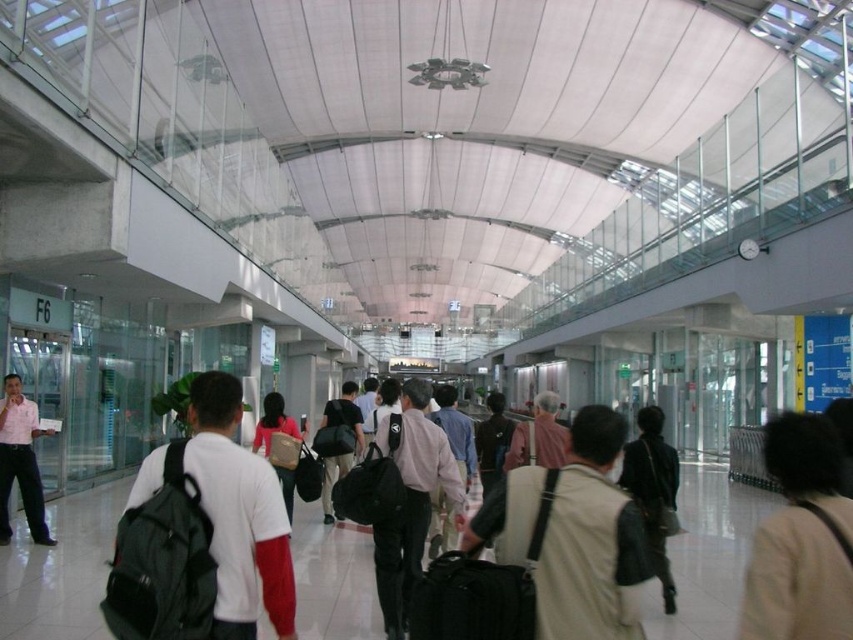
Does matte black backpack at center appear over black fabric suitcase at center?

Yes, matte black backpack at center is above black fabric suitcase at center.

In the scene shown: Does matte black backpack at center lie behind black fabric suitcase at center?

Yes, matte black backpack at center is further from the viewer.

Describe the element at coordinates (410, 500) in the screenshot. This screenshot has height=640, width=853. I see `matte black backpack at center` at that location.

Where is `matte black backpack at center`? matte black backpack at center is located at coordinates (410, 500).

Between point (447, 596) and point (9, 433), which one is positioned behind?

Positioned behind is point (9, 433).

This screenshot has height=640, width=853. What are the coordinates of `black fabric suitcase at center` in the screenshot? It's located at (473, 598).

Where is `black fabric suitcase at center`? Image resolution: width=853 pixels, height=640 pixels. black fabric suitcase at center is located at coordinates (473, 598).

From the picture: Between black fabric suitcase at center and leather jacket at center, which one is positioned higher?

Positioned higher is black fabric suitcase at center.

Locate an element on the screen. The image size is (853, 640). black fabric suitcase at center is located at coordinates (473, 598).